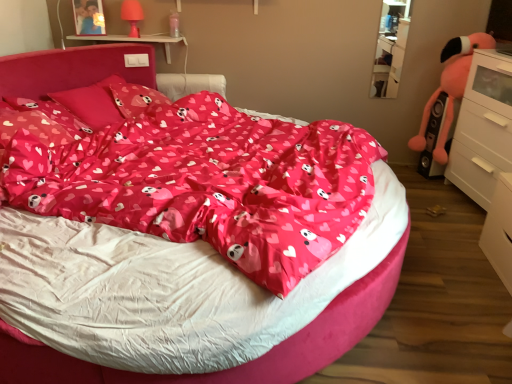
Image resolution: width=512 pixels, height=384 pixels. Identify the location of free point above matte pink pillow at center, which is counted as the first pillow, starting from the back (from a real-world perspective). (135, 87).